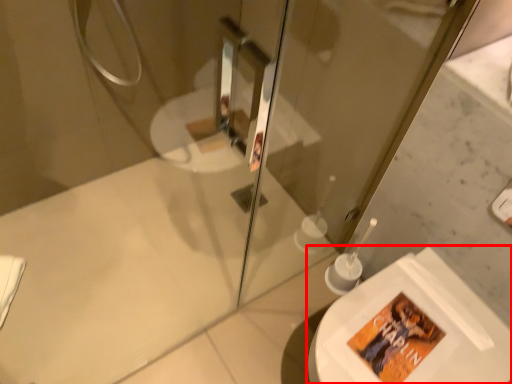
Question: From the image's perspective, what is the correct spatial positioning of toilet (annotated by the red box) in reference to screen door?

Choices:
 (A) below
 (B) above

Answer: (A)